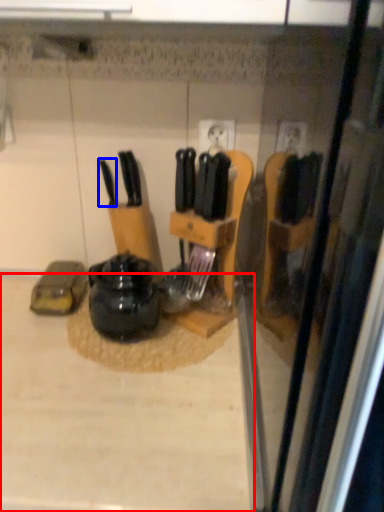
Question: Which point is closer to the camera, counter top (highlighted by a red box) or knife (highlighted by a blue box)?

Choices:
 (A) counter top
 (B) knife

Answer: (A)